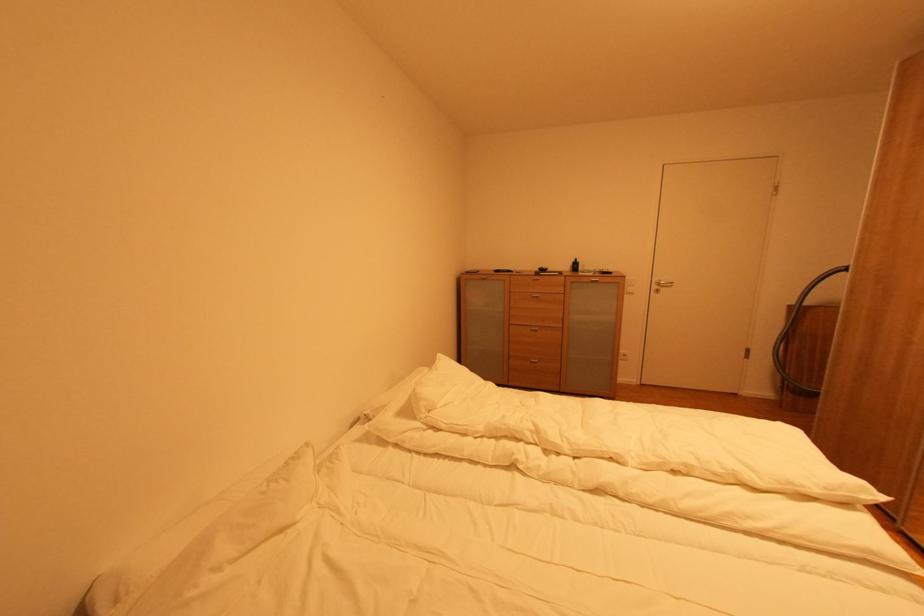
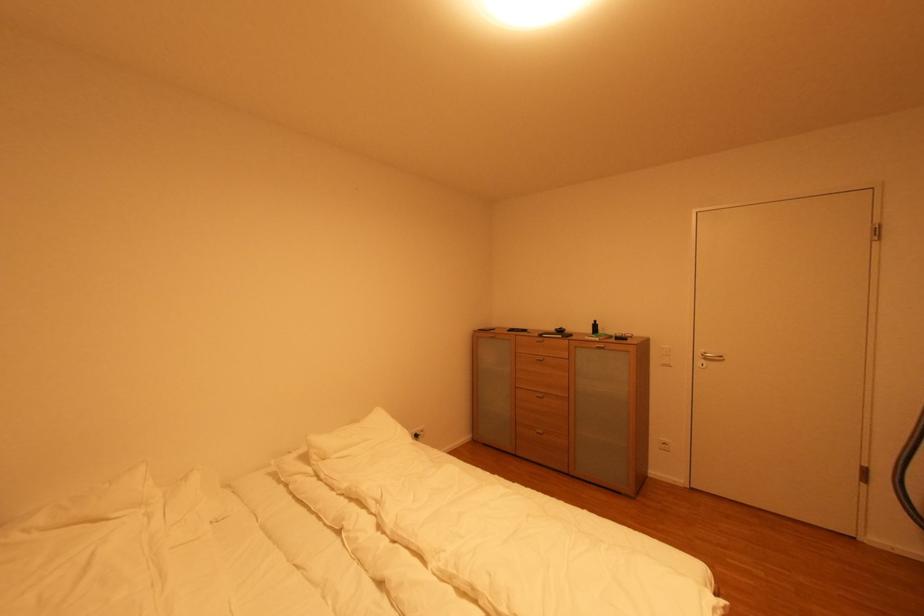
In the second image, find the point that corresponds to point 574,273 in the first image.

(594, 334)